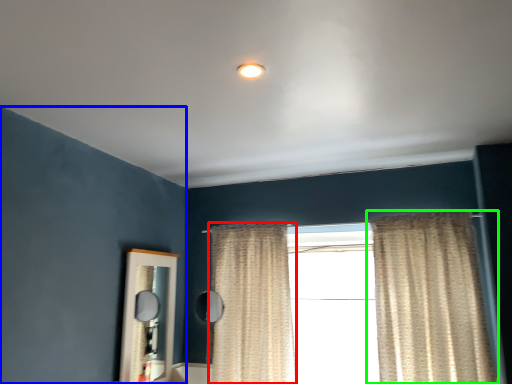
Question: Based on their relative distances, which object is nearer to curtain (highlighted by a red box)? Choose from backdrop (highlighted by a blue box) and curtain (highlighted by a green box).

Choices:
 (A) backdrop
 (B) curtain

Answer: (B)